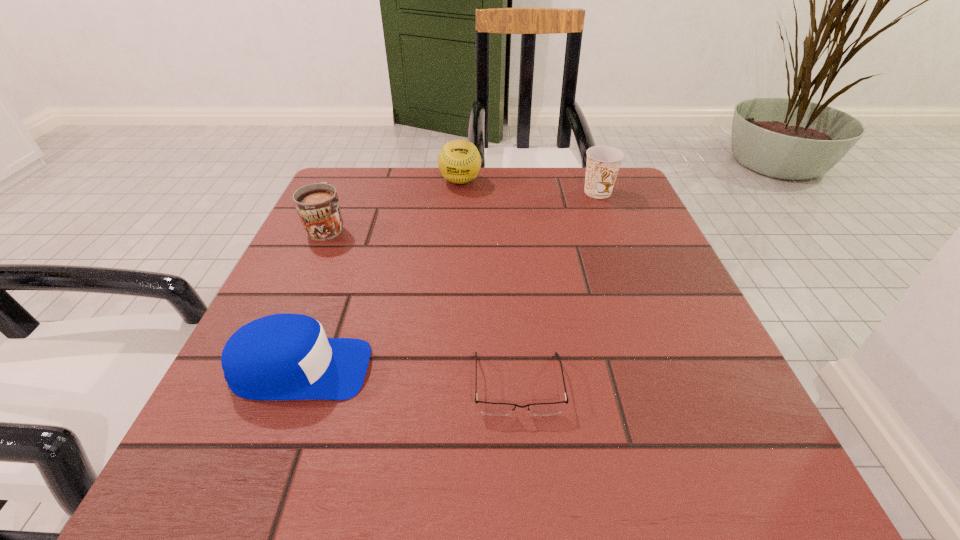
Identify the location of free space between the spectacles and the baseball cap. (409, 377).

You are a GUI agent. You are given a task and a screenshot of the screen. Output one action in this format:
    pyautogui.click(x=<x>, y=<y>)
    Task: Click on the free space between the baseball cap and the rightmost object
    
    Given the screenshot: What is the action you would take?
    pyautogui.click(x=449, y=281)

You are a GUI agent. You are given a task and a screenshot of the screen. Output one action in this format:
    pyautogui.click(x=<x>, y=<y>)
    Task: Click on the free point between the rightmost object and the mug
    
    Given the screenshot: What is the action you would take?
    pyautogui.click(x=463, y=209)

You are a GUI agent. You are given a task and a screenshot of the screen. Output one action in this format:
    pyautogui.click(x=<x>, y=<y>)
    Task: Click on the unoccupied area between the shortest object and the Dixie cup
    Image resolution: width=960 pixels, height=540 pixels.
    Given the screenshot: What is the action you would take?
    (558, 288)

The width and height of the screenshot is (960, 540). I want to click on empty space that is in between the Dixie cup and the softball, so click(x=529, y=187).

Locate an element on the screen. Image resolution: width=960 pixels, height=540 pixels. vacant space that is in between the mug and the softball is located at coordinates (394, 204).

Identify which object is the nearest to the baseball cap. Please provide its 2D coordinates. Your answer should be formatted as a tuple, i.e. [(x, y)], where the tuple contains the x and y coordinates of a point satisfying the conditions above.

[(495, 409)]

Find the location of a particular element. This screenshot has height=540, width=960. the third closest object to the spectacles is located at coordinates (603, 162).